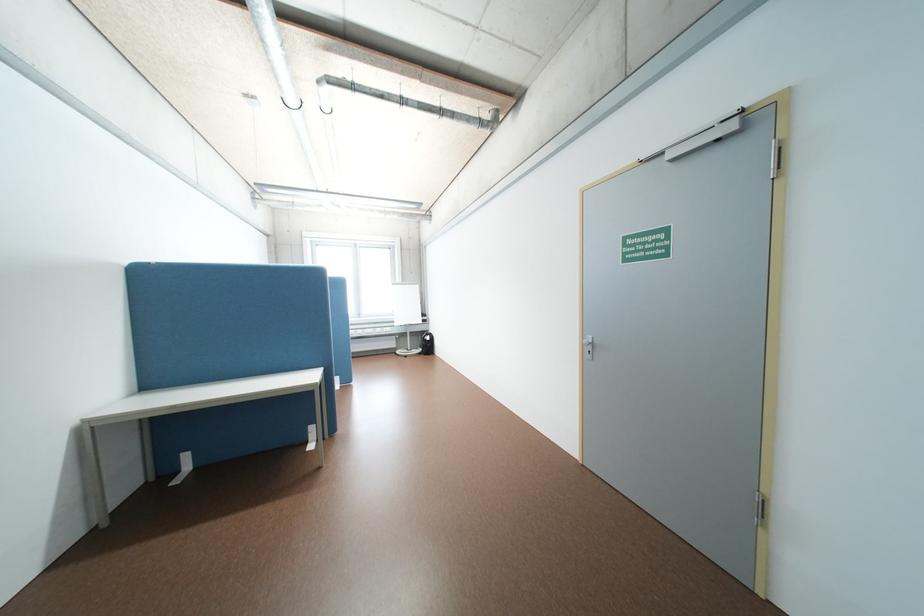
Where would you lift the black backpack? Please return your answer as a coordinate pair (x, y).

(427, 344)